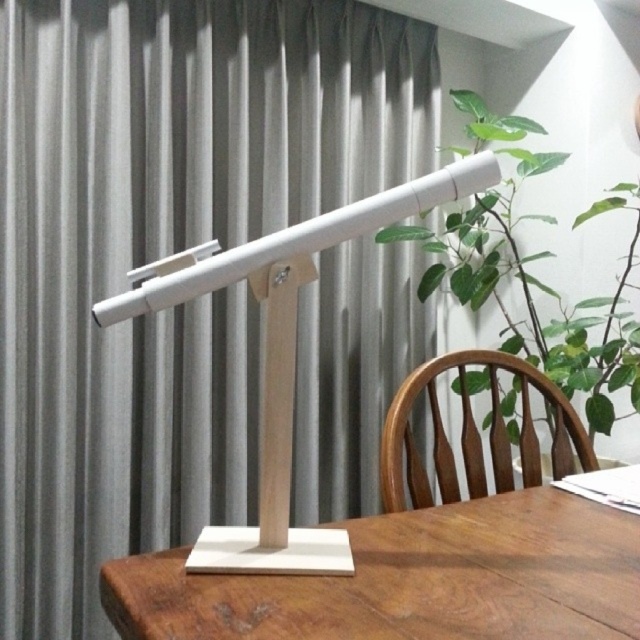
Question: Can you confirm if white matte lamp at center is positioned above green leafy plant at center?

Choices:
 (A) no
 (B) yes

Answer: (A)

Question: Can you confirm if white matte lamp at center is smaller than green leafy plant at center?

Choices:
 (A) yes
 (B) no

Answer: (A)

Question: Estimate the real-world distances between objects in this image. Which object is farther from the wooden table at center?

Choices:
 (A) green leafy plant at center
 (B) brown wooden chair at center
 (C) matte gray curtain at upper center

Answer: (A)

Question: Which point is closer to the camera taking this photo?

Choices:
 (A) (436, 236)
 (B) (618, 528)

Answer: (B)

Question: Does white matte lamp at center appear on the left side of brown wooden chair at center?

Choices:
 (A) yes
 (B) no

Answer: (A)

Question: Considering the real-world distances, which object is farthest from the white matte lamp at center?

Choices:
 (A) brown wooden chair at center
 (B) matte gray curtain at upper center
 (C) green leafy plant at center

Answer: (C)